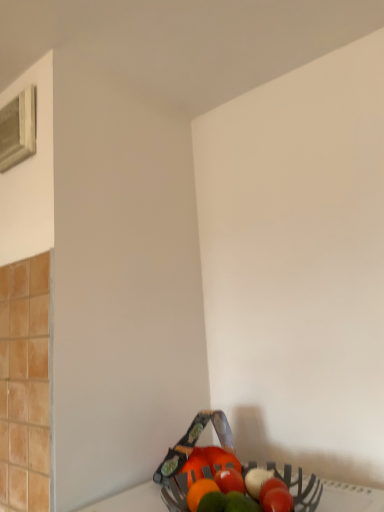
Question: Is metallic basket at lower right bigger or smaller than white wood window at upper left?

Choices:
 (A) big
 (B) small

Answer: (A)

Question: Relative to white wood window at upper left, is metallic basket at lower right in front or behind?

Choices:
 (A) front
 (B) behind

Answer: (A)

Question: Which is correct: metallic basket at lower right is inside white wood window at upper left, or outside of it?

Choices:
 (A) outside
 (B) inside

Answer: (A)

Question: Relative to metallic basket at lower right, is white wood window at upper left in front or behind?

Choices:
 (A) front
 (B) behind

Answer: (B)

Question: Considering the positions of white wood window at upper left and metallic basket at lower right in the image, is white wood window at upper left wider or thinner than metallic basket at lower right?

Choices:
 (A) wide
 (B) thin

Answer: (B)

Question: From the image's perspective, relative to metallic basket at lower right, is white wood window at upper left above or below?

Choices:
 (A) above
 (B) below

Answer: (A)

Question: In terms of size, does white wood window at upper left appear bigger or smaller than metallic basket at lower right?

Choices:
 (A) small
 (B) big

Answer: (A)